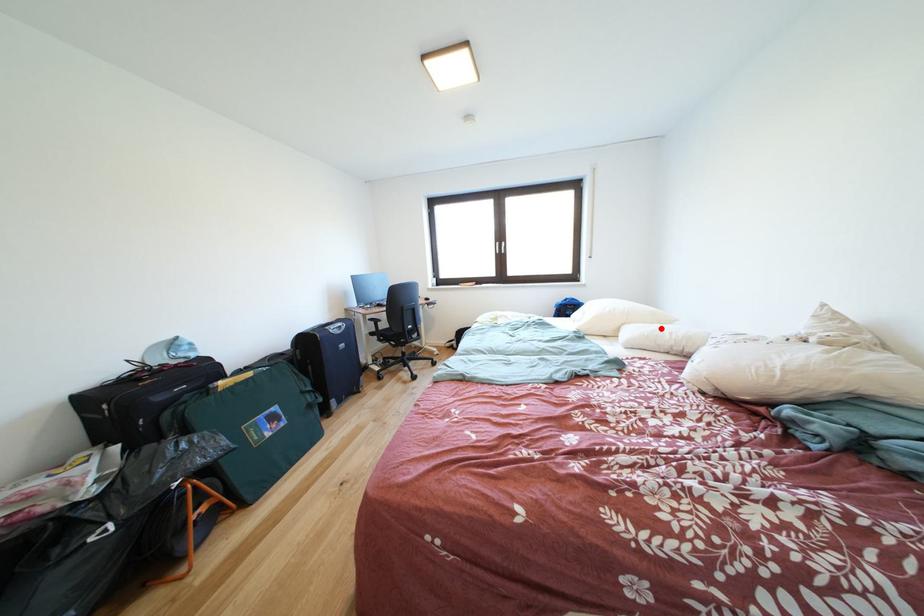
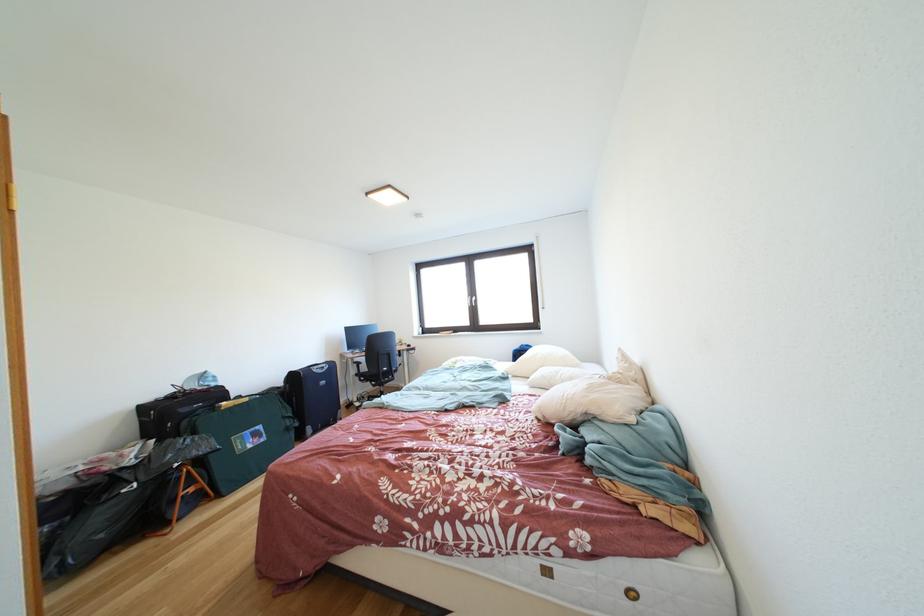
Question: I am providing you with two images of the same scene from different viewpoints. A red point is marked on the first image. Is the red point's position out of view in image 2?

Choices:
 (A) Yes
 (B) No

Answer: (B)